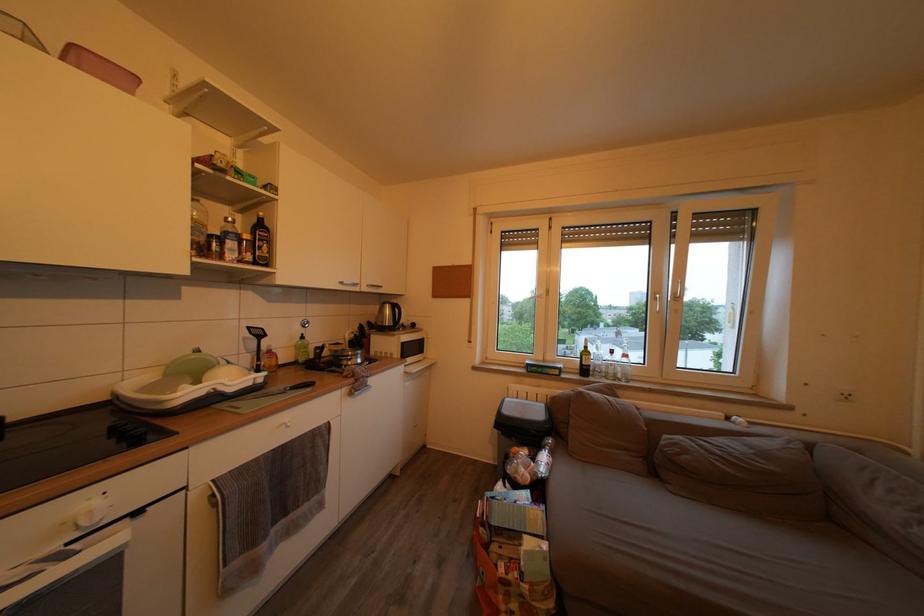
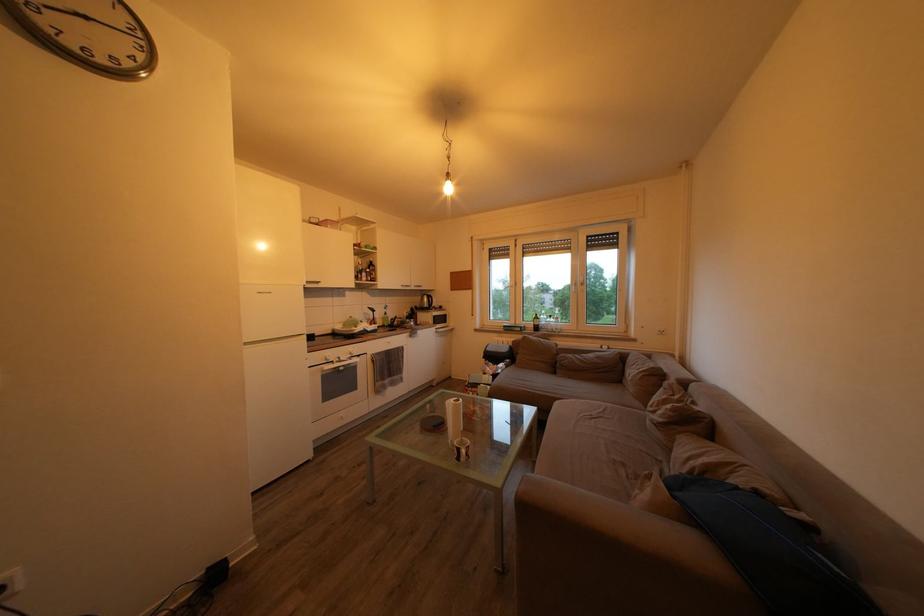
Where in the second image is the point corresponding to pixel 421 354 from the first image?

(448, 326)